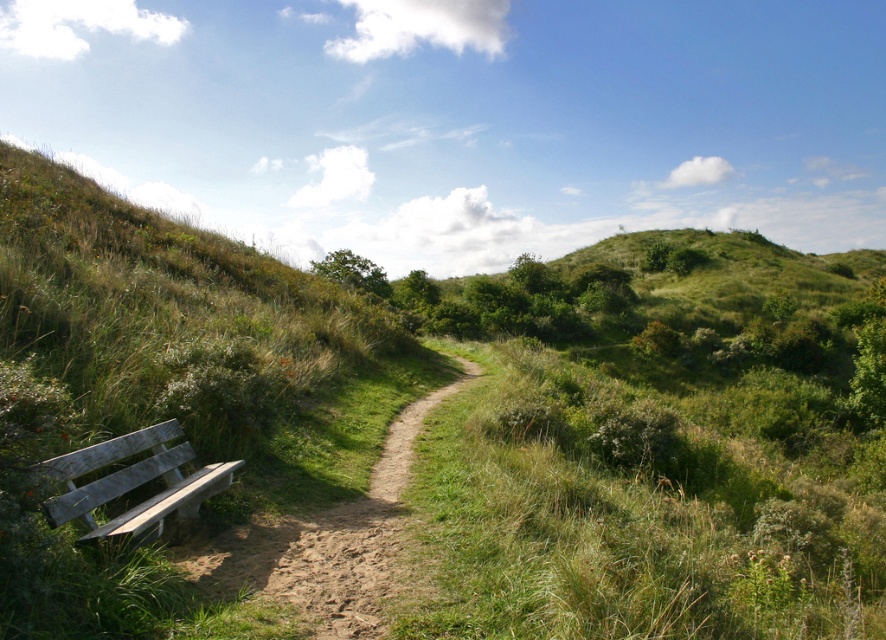
You are standing at the point marked as point (315, 552). What object are you standing on?

You are standing on the brown dirt path at center.

Consider the image. You are a gardener with a wheelbarrow that is 1.2 meters wide. You want to transport some soil along the brown dirt path at center but need to pass by the weathered wood bench at lower left. Can your wheelbarrow fit through the space between the path and the bench?

The brown dirt path at center might be wider than the weathered wood bench at lower left, so the wheelbarrow could potentially fit through the space if the path is indeed wider than the bench. However, the exact width isn